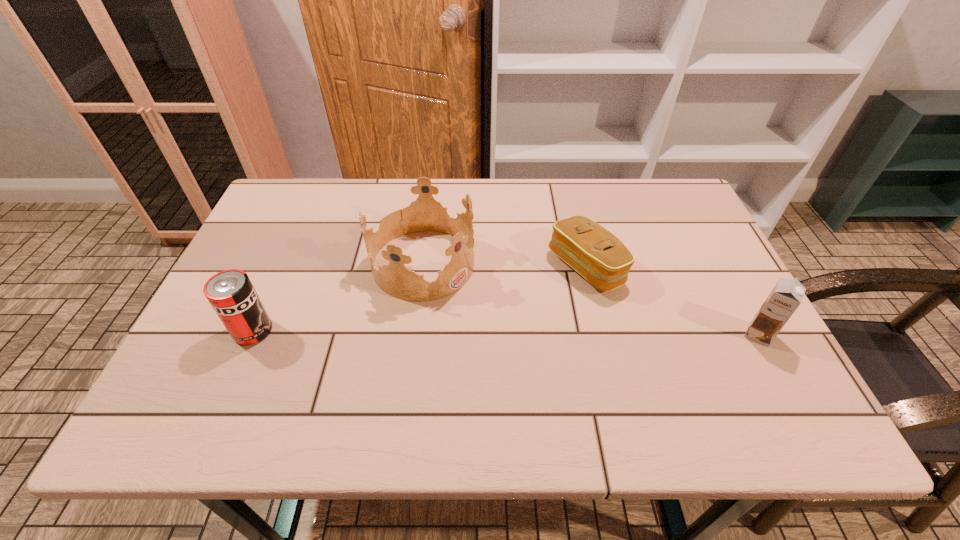
This screenshot has height=540, width=960. Identify the location of the second closest object relative to the second object from right to left. (786, 296).

Find the location of `the closest object to the leftmost object`. the closest object to the leftmost object is located at coordinates (424, 214).

Locate an element on the screen. The height and width of the screenshot is (540, 960). free region that satisfies the following two spatial constraints: 1. on the back side of the can; 2. on the right side of the third object from right to left is located at coordinates (283, 264).